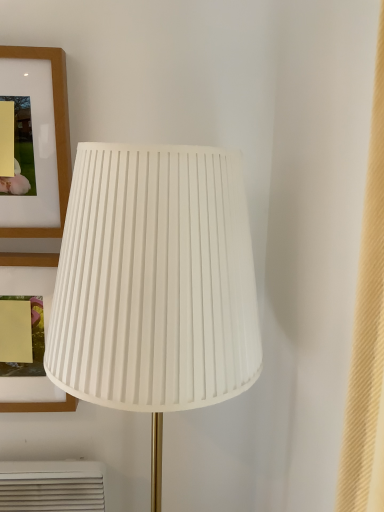
Image resolution: width=384 pixels, height=512 pixels. Find the location of `white pleated fabric lampshade at center`. white pleated fabric lampshade at center is located at coordinates pyautogui.click(x=155, y=284).

The width and height of the screenshot is (384, 512). Identify the location of white pleated fabric lampshade at center. (155, 284).

How many degrees apart are the facing directions of matte wood picture frame at upper left, placed as the second picture frame when sorted from bottom to top, and white pleated fabric lampshade at center?

matte wood picture frame at upper left, placed as the second picture frame when sorted from bottom to top, and white pleated fabric lampshade at center are facing 0.00107 degrees away from each other.

Does matte wood picture frame at upper left, which is the first picture frame from top to bottom, have a smaller size compared to white pleated fabric lampshade at center?

Correct, matte wood picture frame at upper left, which is the first picture frame from top to bottom, occupies less space than white pleated fabric lampshade at center.

From the picture: Is the position of matte wood picture frame at upper left, which is the first picture frame from top to bottom, less distant than that of white pleated fabric lampshade at center?

No, it is not.

Considering the sizes of objects matte wood picture frame at upper left, which is the first picture frame from top to bottom, and white pleated fabric lampshade at center in the image provided, who is wider, matte wood picture frame at upper left, which is the first picture frame from top to bottom, or white pleated fabric lampshade at center?

white pleated fabric lampshade at center is wider.

From a real-world perspective, is matte wood picture frame at upper left, placed as the second picture frame when sorted from bottom to top, positioned above or below matte wood picture frame at upper left, positioned as the 1th picture frame in bottom-to-top order?

matte wood picture frame at upper left, placed as the second picture frame when sorted from bottom to top, is situated higher than matte wood picture frame at upper left, positioned as the 1th picture frame in bottom-to-top order, in the real world.

Who is shorter, matte wood picture frame at upper left, placed as the second picture frame when sorted from bottom to top, or matte wood picture frame at upper left, positioned as the 1th picture frame in bottom-to-top order?

With less height is matte wood picture frame at upper left, placed as the second picture frame when sorted from bottom to top.

Would you consider matte wood picture frame at upper left, placed as the second picture frame when sorted from bottom to top, to be distant from matte wood picture frame at upper left, arranged as the 2th picture frame when viewed from the top?

No.

Considering the points (28, 47) and (72, 399), which point is in front, point (28, 47) or point (72, 399)?

The point (28, 47) is closer to the camera.

From the picture: Between white pleated fabric lampshade at center and matte wood picture frame at upper left, positioned as the 1th picture frame in bottom-to-top order, which one has smaller width?

With smaller width is matte wood picture frame at upper left, positioned as the 1th picture frame in bottom-to-top order.

Based on the photo, which is behind, white pleated fabric lampshade at center or matte wood picture frame at upper left, positioned as the 1th picture frame in bottom-to-top order?

Positioned behind is matte wood picture frame at upper left, positioned as the 1th picture frame in bottom-to-top order.

Is white pleated fabric lampshade at center taller than matte wood picture frame at upper left, arranged as the 2th picture frame when viewed from the top?

Correct, white pleated fabric lampshade at center is much taller as matte wood picture frame at upper left, arranged as the 2th picture frame when viewed from the top.

Considering the positions of objects white pleated fabric lampshade at center and matte wood picture frame at upper left, arranged as the 2th picture frame when viewed from the top, in the image provided, who is more to the left, white pleated fabric lampshade at center or matte wood picture frame at upper left, arranged as the 2th picture frame when viewed from the top,?

matte wood picture frame at upper left, arranged as the 2th picture frame when viewed from the top, is more to the left.

Can you confirm if matte wood picture frame at upper left, positioned as the 1th picture frame in bottom-to-top order, is thinner than matte wood picture frame at upper left, placed as the second picture frame when sorted from bottom to top?

No.

From the image's perspective, between matte wood picture frame at upper left, positioned as the 1th picture frame in bottom-to-top order, and matte wood picture frame at upper left, placed as the second picture frame when sorted from bottom to top, which one is located above?

From the image's view, matte wood picture frame at upper left, placed as the second picture frame when sorted from bottom to top, is above.

Is point (40, 407) farther from viewer compared to point (36, 228)?

Yes.

Is matte wood picture frame at upper left, arranged as the 2th picture frame when viewed from the top, in front of or behind matte wood picture frame at upper left, placed as the second picture frame when sorted from bottom to top, in the image?

In the image, matte wood picture frame at upper left, arranged as the 2th picture frame when viewed from the top, appears behind matte wood picture frame at upper left, placed as the second picture frame when sorted from bottom to top.

Can we say white pleated fabric lampshade at center lies outside matte wood picture frame at upper left, which is the first picture frame from top to bottom?

Yes.

Can you tell me how much white pleated fabric lampshade at center and matte wood picture frame at upper left, placed as the second picture frame when sorted from bottom to top, differ in facing direction?

There is a 0.00107-degree angle between the facing directions of white pleated fabric lampshade at center and matte wood picture frame at upper left, placed as the second picture frame when sorted from bottom to top.

Can you confirm if white pleated fabric lampshade at center is positioned to the left of matte wood picture frame at upper left, placed as the second picture frame when sorted from bottom to top?

No.

Is white pleated fabric lampshade at center aimed at matte wood picture frame at upper left, placed as the second picture frame when sorted from bottom to top?

No, white pleated fabric lampshade at center is not facing towards matte wood picture frame at upper left, placed as the second picture frame when sorted from bottom to top.

Which of these two, matte wood picture frame at upper left, positioned as the 1th picture frame in bottom-to-top order, or white pleated fabric lampshade at center, is wider?

Wider between the two is white pleated fabric lampshade at center.

Can you confirm if matte wood picture frame at upper left, positioned as the 1th picture frame in bottom-to-top order, is shorter than white pleated fabric lampshade at center?

Yes.

Is matte wood picture frame at upper left, arranged as the 2th picture frame when viewed from the top, to the right of white pleated fabric lampshade at center from the viewer's perspective?

In fact, matte wood picture frame at upper left, arranged as the 2th picture frame when viewed from the top, is to the left of white pleated fabric lampshade at center.

Which picture frame is the 2nd one when counting from the left side of the white pleated fabric lampshade at center? Please provide its 2D coordinates.

[(41, 406)]

I want to click on lamp located on the right of matte wood picture frame at upper left, placed as the second picture frame when sorted from bottom to top, so click(x=155, y=284).

The image size is (384, 512). Identify the location of picture frame below the matte wood picture frame at upper left, which is the first picture frame from top to bottom (from the image's perspective). (41, 406).

Based on their spatial positions, is matte wood picture frame at upper left, which is the first picture frame from top to bottom, or white pleated fabric lampshade at center closer to matte wood picture frame at upper left, positioned as the 1th picture frame in bottom-to-top order?

The object closer to matte wood picture frame at upper left, positioned as the 1th picture frame in bottom-to-top order, is white pleated fabric lampshade at center.

From the image, which object appears to be nearer to matte wood picture frame at upper left, arranged as the 2th picture frame when viewed from the top, white pleated fabric lampshade at center or matte wood picture frame at upper left, which is the first picture frame from top to bottom?

The object closer to matte wood picture frame at upper left, arranged as the 2th picture frame when viewed from the top, is white pleated fabric lampshade at center.

When comparing their distances from matte wood picture frame at upper left, placed as the second picture frame when sorted from bottom to top, does matte wood picture frame at upper left, positioned as the 1th picture frame in bottom-to-top order, or white pleated fabric lampshade at center seem further?

matte wood picture frame at upper left, positioned as the 1th picture frame in bottom-to-top order, is positioned further to the anchor matte wood picture frame at upper left, placed as the second picture frame when sorted from bottom to top.

Considering their positions, is matte wood picture frame at upper left, which is the first picture frame from top to bottom, positioned closer to white pleated fabric lampshade at center than matte wood picture frame at upper left, positioned as the 1th picture frame in bottom-to-top order?

matte wood picture frame at upper left, which is the first picture frame from top to bottom, lies closer to white pleated fabric lampshade at center than the other object.

Looking at the image, which one is located further to matte wood picture frame at upper left, placed as the second picture frame when sorted from bottom to top, white pleated fabric lampshade at center or matte wood picture frame at upper left, positioned as the 1th picture frame in bottom-to-top order?

matte wood picture frame at upper left, positioned as the 1th picture frame in bottom-to-top order, is further to matte wood picture frame at upper left, placed as the second picture frame when sorted from bottom to top.

Looking at the image, which one is located closer to white pleated fabric lampshade at center, matte wood picture frame at upper left, positioned as the 1th picture frame in bottom-to-top order, or matte wood picture frame at upper left, which is the first picture frame from top to bottom?

Among the two, matte wood picture frame at upper left, which is the first picture frame from top to bottom, is located nearer to white pleated fabric lampshade at center.

The image size is (384, 512). I want to click on picture frame between matte wood picture frame at upper left, placed as the second picture frame when sorted from bottom to top, and white pleated fabric lampshade at center from top to bottom, so click(41, 406).